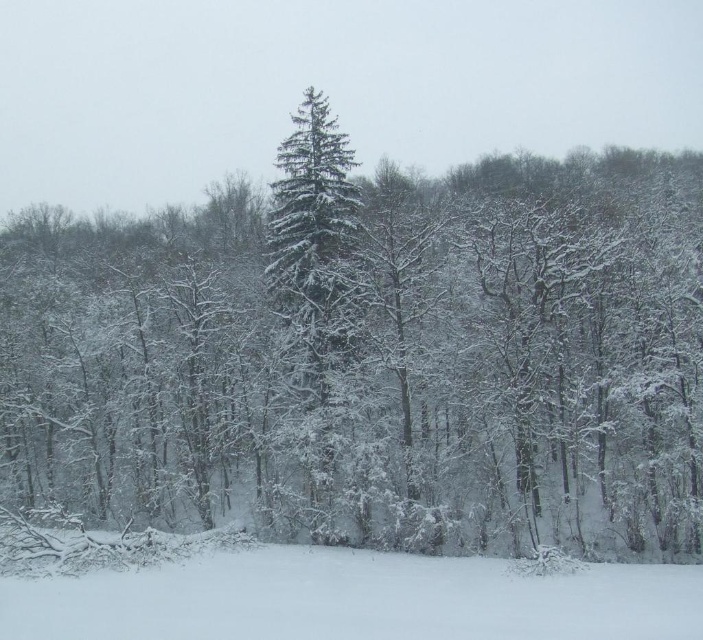
I want to click on white fluffy snow at lower center, so click(x=354, y=600).

Is white fluffy snow at lower center to the right of green matte evergreen tree at center from the viewer's perspective?

Correct, you'll find white fluffy snow at lower center to the right of green matte evergreen tree at center.

Is point (283, 624) positioned after point (307, 125)?

No, (283, 624) is in front of (307, 125).

The width and height of the screenshot is (703, 640). In order to click on white fluffy snow at lower center in this screenshot , I will do `click(354, 600)`.